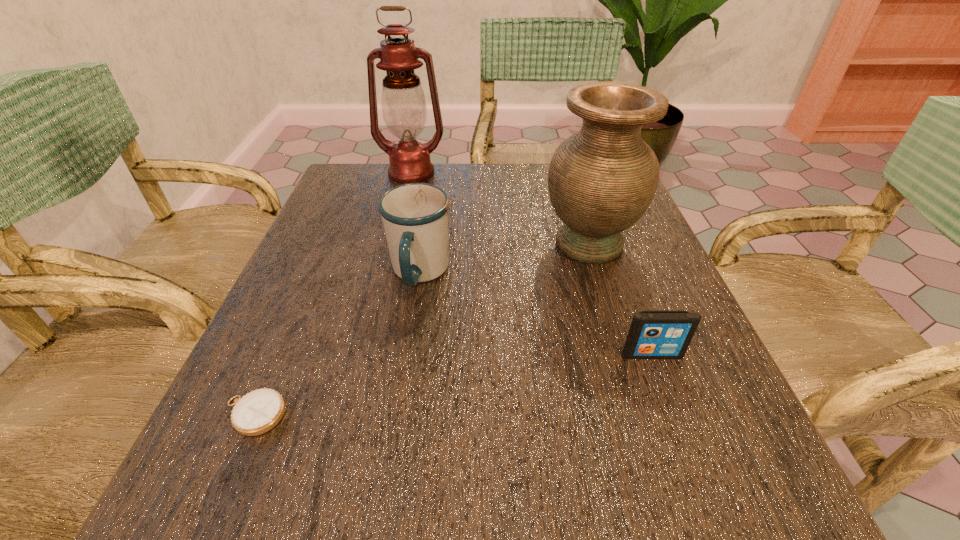
The image size is (960, 540). I want to click on vacant area that lies between the mug and the vase, so click(504, 258).

Identify the location of free space between the vase and the compass. The width and height of the screenshot is (960, 540). (421, 329).

You are a GUI agent. You are given a task and a screenshot of the screen. Output one action in this format:
    pyautogui.click(x=<x>, y=<y>)
    Task: Click on the vacant area between the iPod and the fourth shortest object
    
    Given the screenshot: What is the action you would take?
    pyautogui.click(x=620, y=299)

You are a GUI agent. You are given a task and a screenshot of the screen. Output one action in this format:
    pyautogui.click(x=<x>, y=<y>)
    Task: Click on the unoccupied area between the fourth shortest object and the compass
    This screenshot has height=540, width=960.
    Given the screenshot: What is the action you would take?
    pyautogui.click(x=421, y=329)

Where is `vacant space in between the fourth tallest object and the vase`? The width and height of the screenshot is (960, 540). vacant space in between the fourth tallest object and the vase is located at coordinates (620, 299).

Identify which object is the closest to the vase. Please provide its 2D coordinates. Your answer should be formatted as a tuple, i.e. [(x, y)], where the tuple contains the x and y coordinates of a point satisfying the conditions above.

[(415, 216)]

The height and width of the screenshot is (540, 960). Find the location of `the third closest object to the farthest object`. the third closest object to the farthest object is located at coordinates (257, 412).

Where is `blank space that satisfies the following two spatial constraints: 1. on the back side of the nearest object; 2. on the left side of the oil lamp`? The height and width of the screenshot is (540, 960). blank space that satisfies the following two spatial constraints: 1. on the back side of the nearest object; 2. on the left side of the oil lamp is located at coordinates (358, 173).